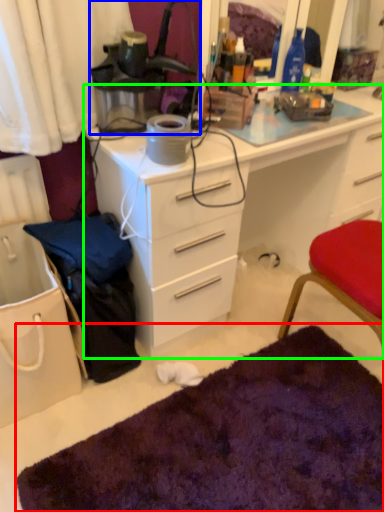
Question: Which is nearer to the doormat (highlighted by a red box)? lamp (highlighted by a blue box) or desk (highlighted by a green box).

Choices:
 (A) lamp
 (B) desk

Answer: (B)